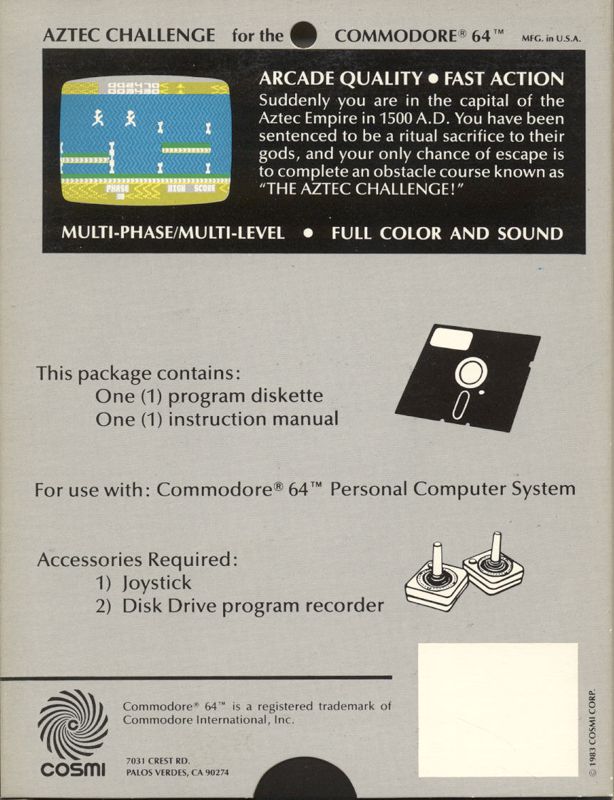
Locate an element on the screen. This screenshot has height=800, width=614. game controllers is located at coordinates (438, 580).